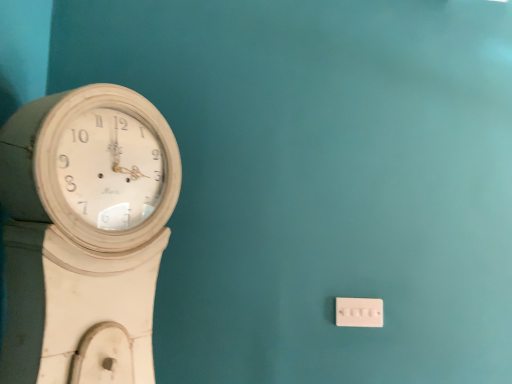
Locate an element on the screen. This screenshot has height=384, width=512. white wooden wall clock at left is located at coordinates (84, 234).

Describe the element at coordinates (84, 234) in the screenshot. I see `white wooden wall clock at left` at that location.

Measure the distance between point (354, 311) and camera.

They are 4.39 feet apart.

Describe the element at coordinates (359, 312) in the screenshot. This screenshot has width=512, height=384. I see `white plastic switch at lower right` at that location.

Image resolution: width=512 pixels, height=384 pixels. Identify the location of white plastic switch at lower right. 359,312.

At what (x,y) coordinates should I click in order to perform the action: click on white wooden wall clock at left. Please return your answer as a coordinate pair (x, y). This screenshot has height=384, width=512. Looking at the image, I should click on (84, 234).

Considering the positions of objects white plastic switch at lower right and white wooden wall clock at left in the image provided, who is more to the right, white plastic switch at lower right or white wooden wall clock at left?

From the viewer's perspective, white plastic switch at lower right appears more on the right side.

Based on the photo, considering their positions, is white plastic switch at lower right located in front of or behind white wooden wall clock at left?

white plastic switch at lower right is positioned farther from the viewer than white wooden wall clock at left.

Which is less distant, (382, 323) or (115, 211)?

Point (115, 211)

From the image's perspective, is white plastic switch at lower right located above or below white wooden wall clock at left?

white plastic switch at lower right is below white wooden wall clock at left.

Based on the photo, from a real-world perspective, which object stands above the other?

From a 3D spatial view, white wooden wall clock at left is above.

Is white plastic switch at lower right wider than white wooden wall clock at left?

No.

Is white plastic switch at lower right taller or shorter than white wooden wall clock at left?

Considering their sizes, white plastic switch at lower right has less height than white wooden wall clock at left.

Between white plastic switch at lower right and white wooden wall clock at left, which one has smaller size?

With smaller size is white plastic switch at lower right.

Is white wooden wall clock at left surrounded by white plastic switch at lower right?

No, white wooden wall clock at left is not surrounded by white plastic switch at lower right.

Is white plastic switch at lower right not close to white wooden wall clock at left?

No, white plastic switch at lower right is not far away from white wooden wall clock at left.

Could you tell me if white plastic switch at lower right is facing white wooden wall clock at left?

No, white plastic switch at lower right is not turned towards white wooden wall clock at left.

How different are the orientations of white plastic switch at lower right and white wooden wall clock at left in degrees?

The facing directions of white plastic switch at lower right and white wooden wall clock at left are 90 degrees apart.

The width and height of the screenshot is (512, 384). I want to click on wall clock on the left of white plastic switch at lower right, so click(x=84, y=234).

Is white wooden wall clock at left to the left or to the right of white plastic switch at lower right in the image?

In the image, white wooden wall clock at left appears on the left side of white plastic switch at lower right.

In the image, is white wooden wall clock at left positioned in front of or behind white plastic switch at lower right?

white wooden wall clock at left is in front of white plastic switch at lower right.

Is point (92, 313) positioned before point (362, 309)?

That is True.

From the image's perspective, between white wooden wall clock at left and white plastic switch at lower right, which one is located above?

white wooden wall clock at left appears higher in the image.

From a real-world perspective, which object stands above the other?

white wooden wall clock at left is physically above.

Which object is thinner, white wooden wall clock at left or white plastic switch at lower right?

white plastic switch at lower right is thinner.

Is white wooden wall clock at left taller or shorter than white plastic switch at lower right?

Considering their sizes, white wooden wall clock at left has more height than white plastic switch at lower right.

Is white wooden wall clock at left bigger or smaller than white plastic switch at lower right?

Clearly, white wooden wall clock at left is larger in size than white plastic switch at lower right.

Would you say white wooden wall clock at left is inside or outside white plastic switch at lower right?

The correct answer is: outside.

Is the surface of white wooden wall clock at left in direct contact with white plastic switch at lower right?

No, white wooden wall clock at left is not next to white plastic switch at lower right.

Could you tell me if white wooden wall clock at left is facing white plastic switch at lower right?

Yes, white wooden wall clock at left is oriented towards white plastic switch at lower right.

Where is `wall clock that appears above the white plastic switch at lower right (from a real-world perspective)`? The height and width of the screenshot is (384, 512). wall clock that appears above the white plastic switch at lower right (from a real-world perspective) is located at coordinates (84, 234).

Where is `wall clock in front of the white plastic switch at lower right`? The width and height of the screenshot is (512, 384). wall clock in front of the white plastic switch at lower right is located at coordinates [x=84, y=234].

Where is `wall clock on the left of the white plastic switch at lower right`? The height and width of the screenshot is (384, 512). wall clock on the left of the white plastic switch at lower right is located at coordinates (84, 234).